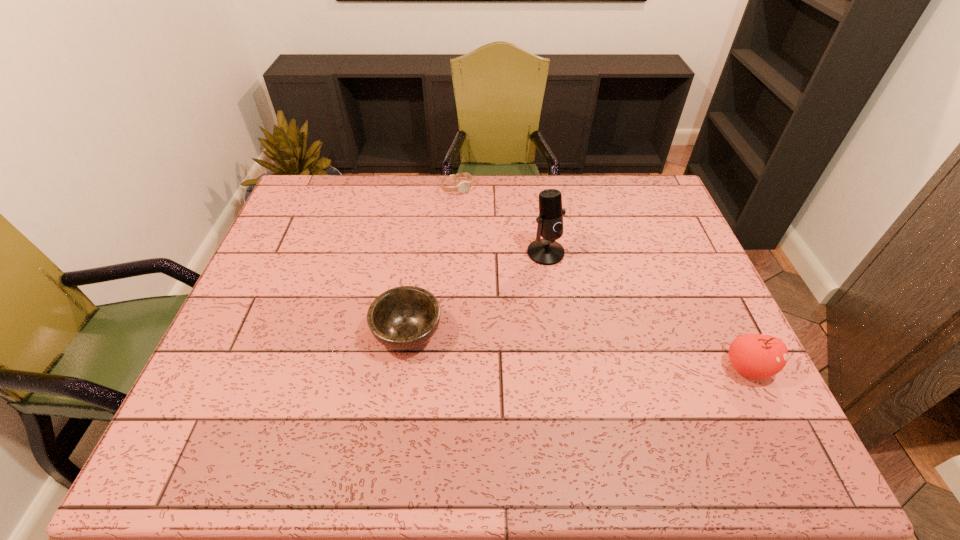
The width and height of the screenshot is (960, 540). In order to click on free space on the desktop that is between the bowl and the third shortest object and is positioned on the stand of the microphone in this screenshot , I will do `click(601, 353)`.

The image size is (960, 540). I want to click on free space on the desktop that is between the bowl and the apple and is positioned on the face of the shortest object, so click(x=598, y=353).